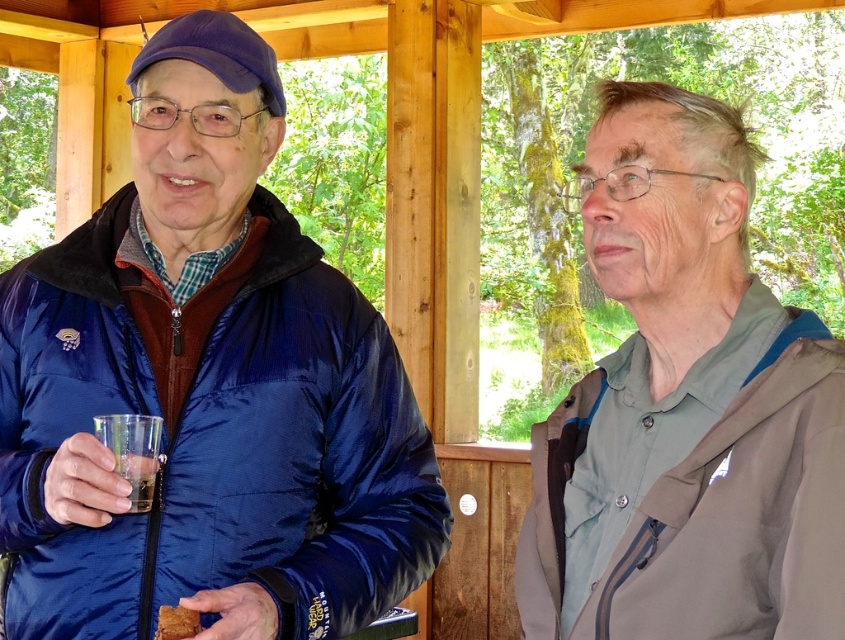
Does point (142, 472) come closer to viewer compared to point (162, 624)?

No, it is behind (162, 624).

Who is shorter, clear plastic cup at left or brown crumbly bread at lower left?

With less height is brown crumbly bread at lower left.

Who is more distant from viewer, (142, 502) or (161, 612)?

Point (142, 502)

Image resolution: width=845 pixels, height=640 pixels. What are the coordinates of `clear plastic cup at left` in the screenshot? It's located at (137, 476).

Does blue quilted jacket at center appear on the right side of gray matte jacket at right?

No, blue quilted jacket at center is not to the right of gray matte jacket at right.

Does point (110, 340) lie in front of point (532, 444)?

No, (110, 340) is further to viewer.

The width and height of the screenshot is (845, 640). I want to click on blue quilted jacket at center, so click(x=206, y=388).

Is point (233, 602) closer to camera compared to point (183, 614)?

No, (233, 602) is further to viewer.

Measure the distance between point (154, 316) and camera.

The distance of point (154, 316) from camera is 1.63 meters.

You are a GUI agent. You are given a task and a screenshot of the screen. Output one action in this format:
    pyautogui.click(x=<x>, y=<y>)
    Task: Click on the blue quilted jacket at center
    This screenshot has height=640, width=845.
    Given the screenshot: What is the action you would take?
    pyautogui.click(x=206, y=388)